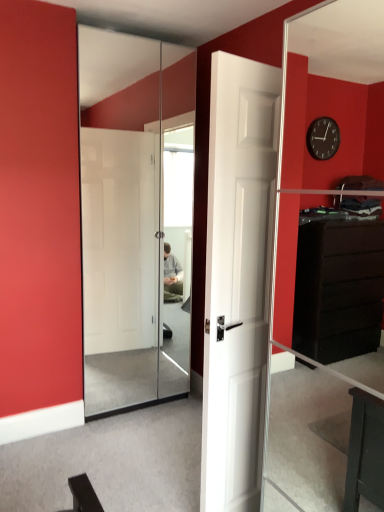
Question: From a real-world perspective, is white matte door at center over white glossy sliding doors at center?

Choices:
 (A) yes
 (B) no

Answer: (B)

Question: Is white matte door at center touching white glossy sliding doors at center?

Choices:
 (A) no
 (B) yes

Answer: (A)

Question: Could you tell me if white matte door at center is facing white glossy sliding doors at center?

Choices:
 (A) no
 (B) yes

Answer: (B)

Question: Does white matte door at center have a greater width compared to white glossy sliding doors at center?

Choices:
 (A) no
 (B) yes

Answer: (B)

Question: From the image's perspective, does white matte door at center appear higher than white glossy sliding doors at center?

Choices:
 (A) yes
 (B) no

Answer: (B)

Question: Is there a large distance between white matte door at center and white glossy sliding doors at center?

Choices:
 (A) no
 (B) yes

Answer: (B)

Question: Would you say white glossy sliding doors at center is outside white matte door at center?

Choices:
 (A) yes
 (B) no

Answer: (A)

Question: From the image's perspective, is white glossy sliding doors at center located beneath white matte door at center?

Choices:
 (A) yes
 (B) no

Answer: (B)

Question: Is white glossy sliding doors at center smaller than white matte door at center?

Choices:
 (A) no
 (B) yes

Answer: (B)

Question: Is white glossy sliding doors at center taller than white matte door at center?

Choices:
 (A) yes
 (B) no

Answer: (A)

Question: Is white glossy sliding doors at center thinner than white matte door at center?

Choices:
 (A) yes
 (B) no

Answer: (A)

Question: Is white matte door at center surrounded by white glossy sliding doors at center?

Choices:
 (A) yes
 (B) no

Answer: (B)

Question: Does point (213, 492) appear closer or farther from the camera than point (86, 145)?

Choices:
 (A) closer
 (B) farther

Answer: (A)